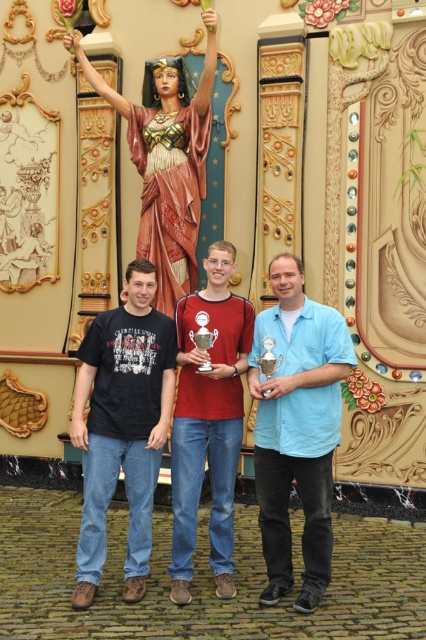
Question: Considering the real-world distances, which object is farthest from the matte red shirt at center?

Choices:
 (A) black cotton t-shirt at center
 (B) blue cotton shirt at center
 (C) wooden statue at center

Answer: (C)

Question: From the image, what is the correct spatial relationship of black cotton t-shirt at center in relation to wooden statue at center?

Choices:
 (A) right
 (B) left

Answer: (B)

Question: Estimate the real-world distances between objects in this image. Which object is farther from the matte red shirt at center?

Choices:
 (A) wooden statue at center
 (B) black cotton t-shirt at center

Answer: (A)

Question: Is blue cotton shirt at center bigger than wooden statue at center?

Choices:
 (A) yes
 (B) no

Answer: (B)

Question: Which of these objects is positioned farthest from the wooden statue at center?

Choices:
 (A) black cotton t-shirt at center
 (B) matte red shirt at center

Answer: (A)

Question: Can you confirm if black cotton t-shirt at center is positioned to the left of matte red shirt at center?

Choices:
 (A) no
 (B) yes

Answer: (B)